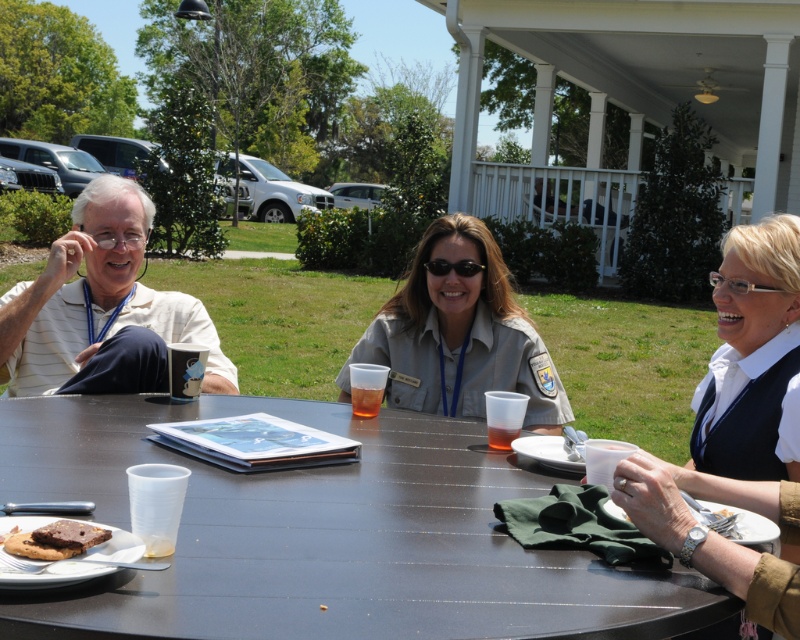
You are a photographer trying to capture a group photo of the white matte vest at right and the matte white shirt at left. Since both are white, you need to adjust your camera settings to ensure proper exposure. Which subject should you meter off of to avoid overexposure?

You should meter off the matte white shirt at left because the white matte vest at right is positioned on the right side of matte white shirt at left, so it might be in a different lighting condition which could affect exposure.

You are a food delivery person who needs to place a matte brownie at lower left and a translucent plastic cup at center into a small cooler. The cooler has limited vertical space. Which item should you place first to ensure both fit?

Since the matte brownie at lower left is much taller than the translucent plastic cup at center, you should place the translucent plastic cup at center first, then the matte brownie at lower left on top to maximize vertical space.